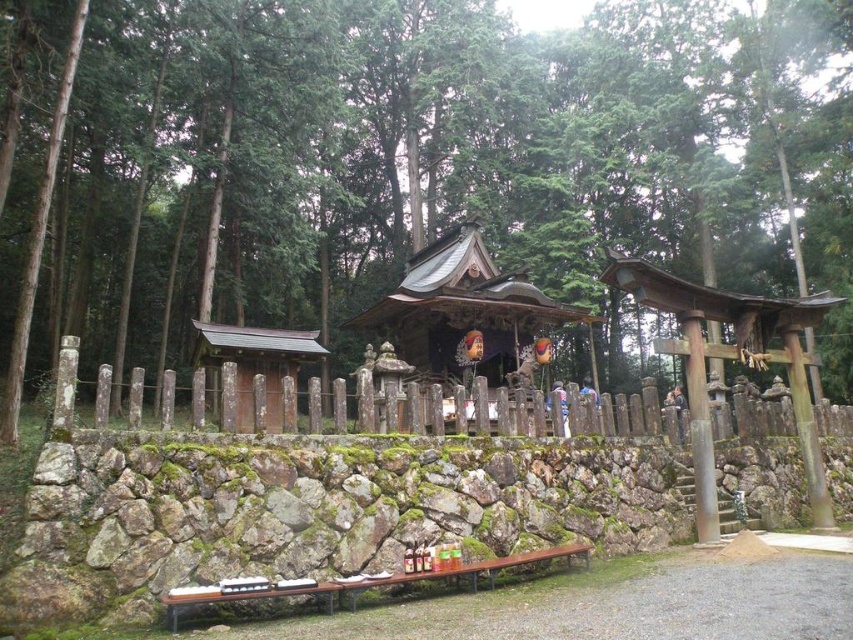
Is weathered wood fence at center wider than smooth wooden hut at left?

Correct, the width of weathered wood fence at center exceeds that of smooth wooden hut at left.

Between weathered wood fence at center and smooth wooden hut at left, which one appears on the left side from the viewer's perspective?

From the viewer's perspective, smooth wooden hut at left appears more on the left side.

Between point (167, 387) and point (302, 336), which one is positioned behind?

Point (302, 336)

Find the location of a particular element. The image size is (853, 640). weathered wood fence at center is located at coordinates (480, 413).

Looking at this image, between wooden shrine at center and smooth wooden hut at left, which one has less height?

With less height is smooth wooden hut at left.

Which is behind, point (448, 240) or point (310, 330)?

Point (310, 330)

Is point (456, 323) less distant than point (241, 358)?

No, (456, 323) is further to viewer.

Locate an element on the screen. The width and height of the screenshot is (853, 640). wooden shrine at center is located at coordinates (467, 314).

Which is behind, point (254, 29) or point (241, 348)?

The point (254, 29) is behind.

Is green mossy stone wall at center bigger than smooth wooden hut at left?

Indeed, green mossy stone wall at center has a larger size compared to smooth wooden hut at left.

Which is behind, point (184, 300) or point (236, 417)?

Point (184, 300)

Locate an element on the screen. This screenshot has height=640, width=853. green mossy stone wall at center is located at coordinates (405, 150).